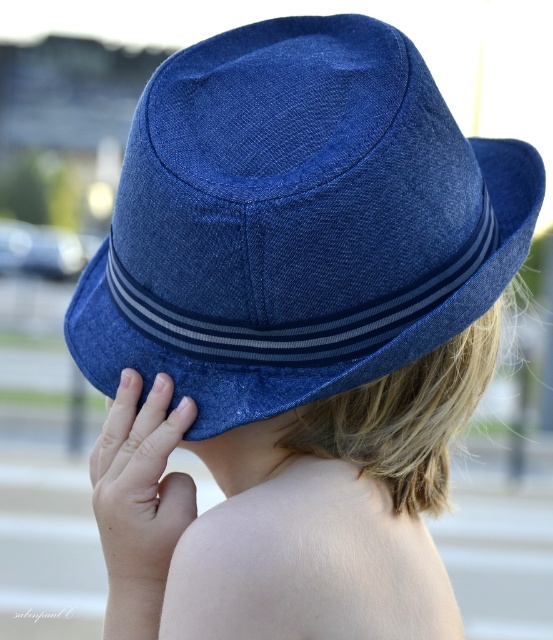
You are a photographer adjusting your camera settings to focus on the denim blue fedora at back and the matte blue hat at upper center. Which hat should you focus on first to ensure both are in sharp focus, considering their positions?

You should focus on the denim blue fedora at back first because it is closer to the viewer than the matte blue hat at upper center, ensuring both are in focus when adjusting the depth of field.

You are a photographer standing 10 feet away from the child. You want to take a closeup shot of the denim blue fedora at back without moving closer. Can you do it using a standard zoom lens with a maximum zoom range of 200mm?

The denim blue fedora at back is 36.87 inches away from the viewer. Since 36.87 inches is approximately 3.07 feet, and the photographer is 10 feet away, the total distance is about 13.07 feet. A standard zoom lens with a maximum of 200mm can effectively capture closeup shots from distances up to around 15 feet, so yes, it should be possible to take the closeup without moving closer.

You are a photographer trying to capture the child wearing the denim blue fedora at back and the matte blue hat at upper center. Which hat will appear larger in the photo due to its height?

The denim blue fedora at back will appear larger in the photo because it is much taller than the matte blue hat at upper center.